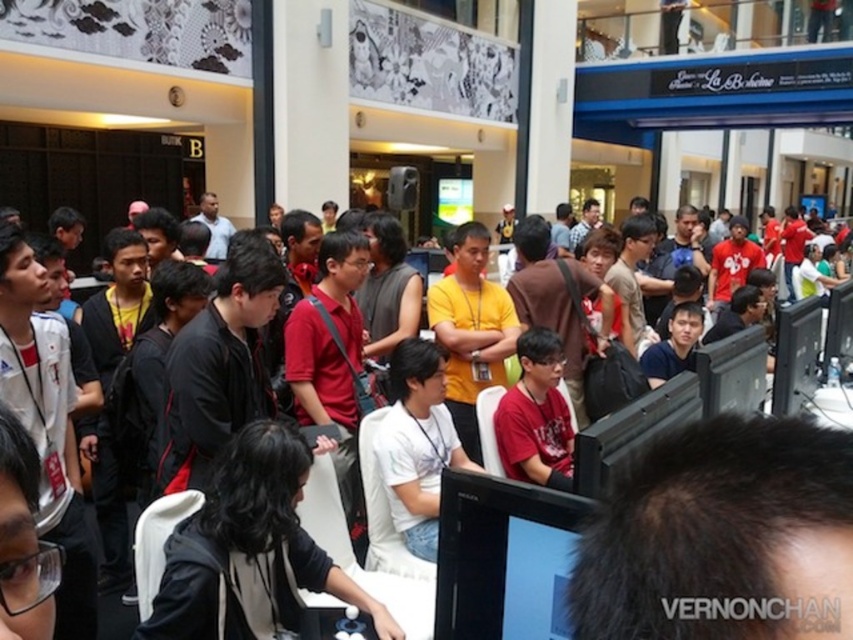
You are a photographer standing at the back of the room. You want to take a photo of the red matte shirt at center without the black glossy monitor at center blocking the view. Is this possible based on their positions?

The black glossy monitor at center is in front of the red matte shirt at center, so it will block the view. Move to a different angle where the monitor is not obstructing the shirt.

You are organizing a gaming event and need to ensure that the black glossy monitor at center is visible to everyone in the front row. Given that the red matte shirt at center is blocking part of the monitor, can you confirm if the monitor is still mostly visible?

The black glossy monitor at center has a smaller size compared to the red matte shirt at center. Since the monitor is smaller, it is likely that the red matte shirt at center is blocking a significant portion of it, making it less visible to the front row.